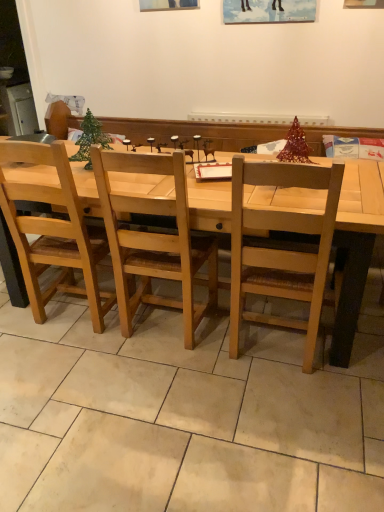
Find the location of a particular element. This screenshot has height=512, width=384. vacant space situated on the left part of light wood chair at center, the 2th chair viewed from the left is located at coordinates (189, 355).